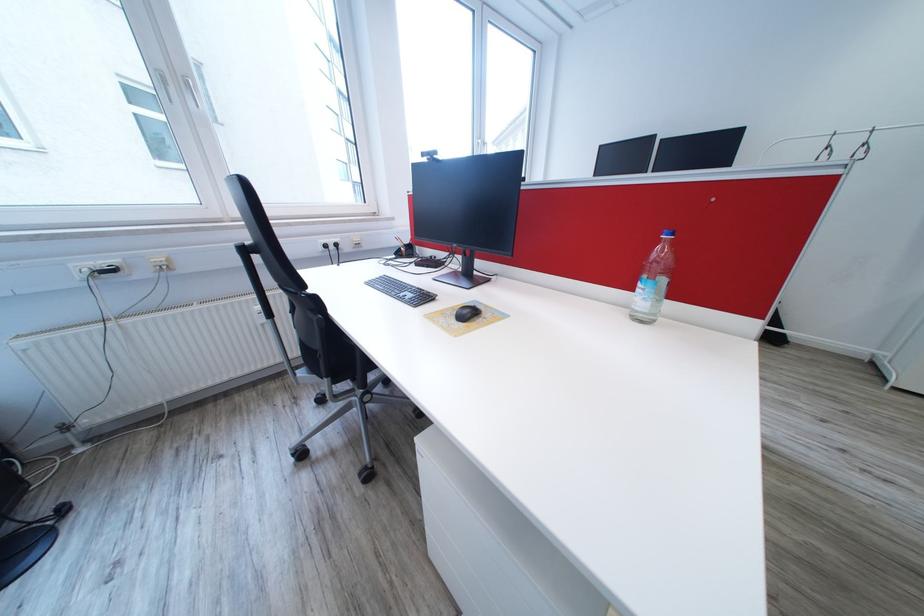
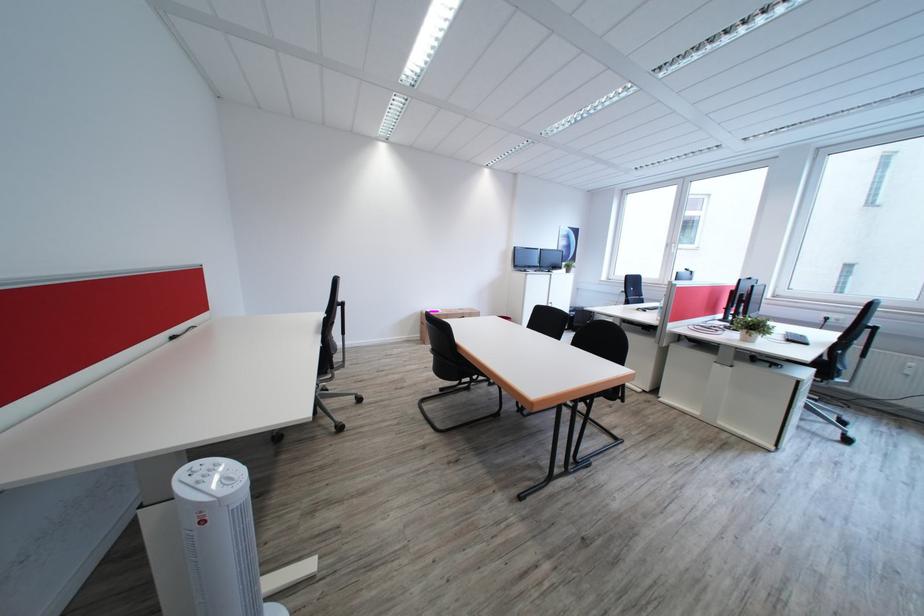
Question: I am providing you with two images of the same scene from different viewpoints. After the viewpoint changes to image2, which objects are now occluded?

Choices:
 (A) pink case
 (B) chair sitting surface
 (C) black computer mouse
 (D) small plant pot

Answer: (B)